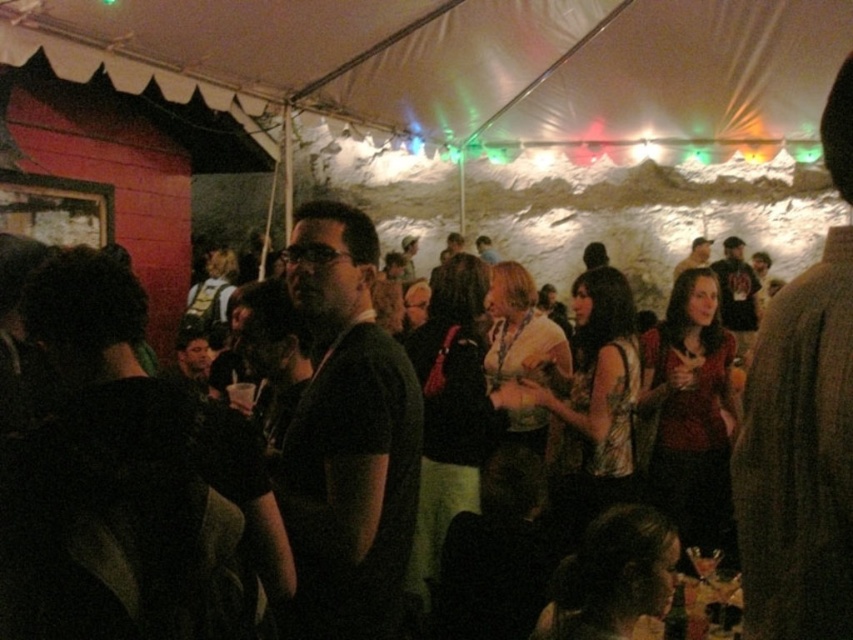
Who is positioned more to the right, dark fabric shirt at left or dark gray t-shirt at center?

dark gray t-shirt at center

Based on the photo, which is more to the left, dark fabric shirt at left or dark gray t-shirt at center?

From the viewer's perspective, dark fabric shirt at left appears more on the left side.

Describe the element at coordinates (126, 483) in the screenshot. This screenshot has height=640, width=853. I see `dark fabric shirt at left` at that location.

Where is `dark fabric shirt at left`? dark fabric shirt at left is located at coordinates (126, 483).

Is dark green t-shirt at center above dark gray t-shirt at center?

Actually, dark green t-shirt at center is below dark gray t-shirt at center.

Consider the image. Is dark green t-shirt at center smaller than dark gray t-shirt at center?

Yes.

Is point (355, 221) closer to camera compared to point (718, 260)?

Yes, point (355, 221) is in front of point (718, 260).

At what (x,y) coordinates should I click in order to perform the action: click on dark green t-shirt at center. Please return your answer as a coordinate pair (x, y). The image size is (853, 640). Looking at the image, I should click on (347, 436).

Can you confirm if dark clothing at center is bigger than dark green t-shirt at center?

Yes.

Which is below, dark clothing at center or dark green t-shirt at center?

Positioned lower is dark green t-shirt at center.

Looking at this image, who is more distant from viewer, (16, 460) or (293, 301)?

The point (293, 301) is more distant.

The height and width of the screenshot is (640, 853). I want to click on dark clothing at center, so [x=115, y=480].